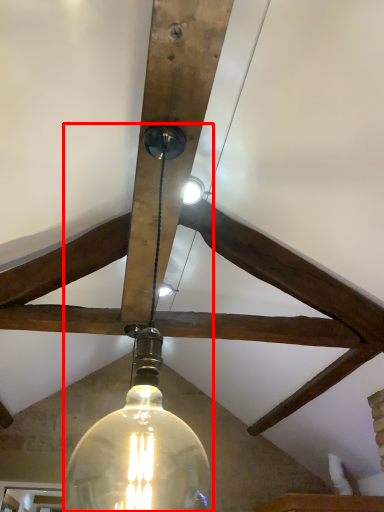
Question: From the image's perspective, what is the correct spatial positioning of lamp (annotated by the red box) in reference to light bulb?

Choices:
 (A) below
 (B) above

Answer: (B)